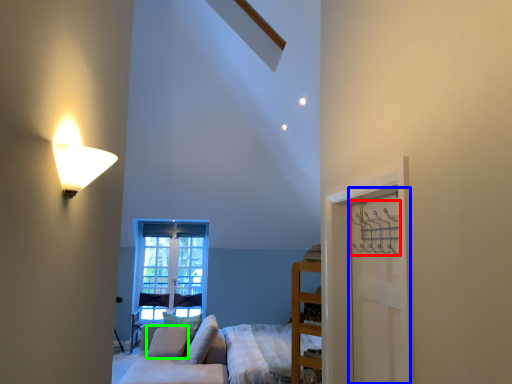
Question: Estimate the real-world distances between objects in this image. Which object is closer to hanger (highlighted by a red box), door (highlighted by a blue box) or pillow (highlighted by a green box)?

Choices:
 (A) door
 (B) pillow

Answer: (A)